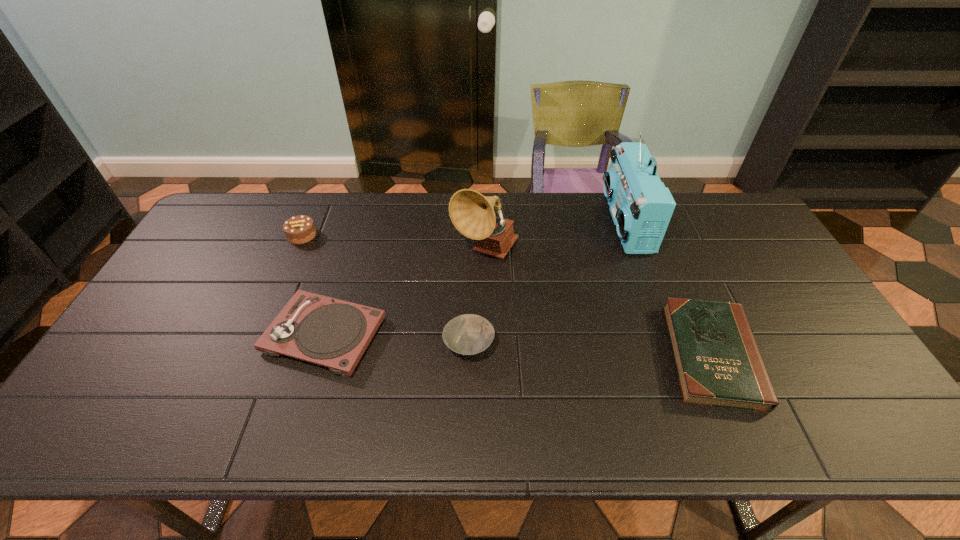
You are a GUI agent. You are given a task and a screenshot of the screen. Output one action in this format:
    pyautogui.click(x=<x>, y=<y>)
    Task: Click on the vacant space situated on the front-facing side of the radio receiver
    Image resolution: width=960 pixels, height=540 pixels.
    Given the screenshot: What is the action you would take?
    pyautogui.click(x=525, y=222)

The width and height of the screenshot is (960, 540). What are the coordinates of `vacant space located 0.100m on the horn of the right phonograph_record` in the screenshot? It's located at (486, 298).

I want to click on vacant region located 0.140m on the back of the chocolate cake, so click(x=317, y=201).

Identify the location of vacant space located 0.180m on the left of the left phonograph_record. (198, 335).

At what (x,y) coordinates should I click in order to perform the action: click on free space located 0.310m on the right of the bowl. Please return your answer as a coordinate pair (x, y). Image resolution: width=960 pixels, height=540 pixels. Looking at the image, I should click on (613, 345).

Identify the location of vacant position located 0.280m on the left of the Bible. (557, 355).

This screenshot has width=960, height=540. Identify the location of radio receiver at the far edge. (641, 206).

This screenshot has width=960, height=540. I want to click on phonograph record that is positioned at the far edge, so click(x=472, y=214).

The image size is (960, 540). Find the location of `chocolate cake that is at the far edge`. chocolate cake that is at the far edge is located at coordinates (300, 229).

Where is `object positioned at the near edge`? The height and width of the screenshot is (540, 960). object positioned at the near edge is located at coordinates (718, 363).